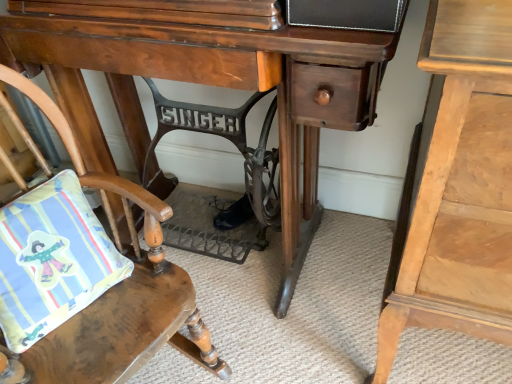
Where is `light wood nightstand at right`? This screenshot has width=512, height=384. light wood nightstand at right is located at coordinates (460, 185).

This screenshot has height=384, width=512. What do you see at coordinates (120, 290) in the screenshot? I see `wooden cushioned chair at lower left` at bounding box center [120, 290].

Find the location of a particular element. wooden desk at center is located at coordinates point(206,80).

This screenshot has height=384, width=512. Describe the element at coordinates (52, 260) in the screenshot. I see `matte cotton pillow at lower left` at that location.

The width and height of the screenshot is (512, 384). Identify the location of light wood nightstand at right. (460, 185).

Is wooden desk at center not inside wooden cushioned chair at lower left?

wooden desk at center lies outside wooden cushioned chair at lower left's area.

Consider the image. Which object is more forward, wooden desk at center or wooden cushioned chair at lower left?

Positioned in front is wooden cushioned chair at lower left.

Considering the sizes of objects wooden desk at center and wooden cushioned chair at lower left in the image provided, who is bigger, wooden desk at center or wooden cushioned chair at lower left?

With larger size is wooden desk at center.

Which object is wider, wooden desk at center or wooden cushioned chair at lower left?

wooden cushioned chair at lower left is wider.

Are wooden desk at center and light wood nightstand at right located far from each other?

No, there isn't a large distance between wooden desk at center and light wood nightstand at right.

Is wooden desk at center shorter than light wood nightstand at right?

Indeed, wooden desk at center has a lesser height compared to light wood nightstand at right.

Would you say wooden desk at center contains light wood nightstand at right?

No, light wood nightstand at right is not inside wooden desk at center.

From a real-world perspective, is wooden desk at center above or below light wood nightstand at right?

wooden desk at center is below light wood nightstand at right.

Relative to matte cotton pillow at lower left, is light wood nightstand at right in front or behind?

light wood nightstand at right is positioned closer to the viewer than matte cotton pillow at lower left.

Would you say light wood nightstand at right is to the left or to the right of matte cotton pillow at lower left in the picture?

light wood nightstand at right is positioned on matte cotton pillow at lower left's right side.

Is light wood nightstand at right facing towards matte cotton pillow at lower left?

No, light wood nightstand at right is not turned towards matte cotton pillow at lower left.

Measure the distance from light wood nightstand at right to matte cotton pillow at lower left.

light wood nightstand at right and matte cotton pillow at lower left are 23.46 inches apart.

Measure the distance from matte cotton pillow at lower left to light wood nightstand at right.

23.46 inches.

What are the coordinates of `nightstand lying above the matte cotton pillow at lower left (from the image's perspective)` in the screenshot? It's located at (460, 185).

From the image's perspective, who appears lower, matte cotton pillow at lower left or light wood nightstand at right?

matte cotton pillow at lower left, from the image's perspective.

Considering the relative sizes of wooden cushioned chair at lower left and wooden desk at center in the image provided, is wooden cushioned chair at lower left shorter than wooden desk at center?

Yes, wooden cushioned chair at lower left is shorter than wooden desk at center.

Can you tell me how much wooden cushioned chair at lower left and wooden desk at center differ in facing direction?

wooden cushioned chair at lower left and wooden desk at center are facing 68.8 degrees away from each other.

Considering the relative sizes of wooden cushioned chair at lower left and wooden desk at center in the image provided, is wooden cushioned chair at lower left bigger than wooden desk at center?

Actually, wooden cushioned chair at lower left might be smaller than wooden desk at center.

What are the coordinates of `desk that appears above the wooden cushioned chair at lower left (from the image's perspective)` in the screenshot? It's located at (206, 80).

Is point (65, 119) positioned before point (39, 252)?

No, (65, 119) is further to viewer.

Looking at this image, what's the angular difference between wooden cushioned chair at lower left and matte cotton pillow at lower left's facing directions?

There is a 0.974-degree angle between the facing directions of wooden cushioned chair at lower left and matte cotton pillow at lower left.

Is wooden cushioned chair at lower left touching matte cotton pillow at lower left?

wooden cushioned chair at lower left is not next to matte cotton pillow at lower left, and they're not touching.

Do you think wooden cushioned chair at lower left is within matte cotton pillow at lower left, or outside of it?

wooden cushioned chair at lower left cannot be found inside matte cotton pillow at lower left.

Is wooden desk at center aimed at matte cotton pillow at lower left?

Yes, wooden desk at center is turned towards matte cotton pillow at lower left.

How distant is wooden desk at center from matte cotton pillow at lower left?

They are 14.33 inches apart.

Is wooden desk at center placed right next to matte cotton pillow at lower left?

No, wooden desk at center is not next to matte cotton pillow at lower left.

Is wooden desk at center inside the boundaries of matte cotton pillow at lower left, or outside?

wooden desk at center exists outside the volume of matte cotton pillow at lower left.

Where is `chair lying in front of the wooden desk at center`? The image size is (512, 384). chair lying in front of the wooden desk at center is located at coordinates (120, 290).

Identify the location of desk above the light wood nightstand at right (from the image's perspective). (206, 80).

When comparing their distances from light wood nightstand at right, does matte cotton pillow at lower left or wooden desk at center seem further?

matte cotton pillow at lower left.

From the image, which object appears to be farther from wooden desk at center, wooden cushioned chair at lower left or light wood nightstand at right?

light wood nightstand at right lies further to wooden desk at center than the other object.

Considering their positions, is light wood nightstand at right positioned closer to wooden cushioned chair at lower left than wooden desk at center?

wooden desk at center is closer to wooden cushioned chair at lower left.

Estimate the real-world distances between objects in this image. Which object is closer to matte cotton pillow at lower left, wooden desk at center or light wood nightstand at right?

wooden desk at center is positioned closer to the anchor matte cotton pillow at lower left.

Considering their positions, is wooden desk at center positioned further to wooden cushioned chair at lower left than light wood nightstand at right?

Based on the image, light wood nightstand at right appears to be further to wooden cushioned chair at lower left.

Estimate the real-world distances between objects in this image. Which object is closer to wooden cushioned chair at lower left, wooden desk at center or matte cotton pillow at lower left?

The object closer to wooden cushioned chair at lower left is matte cotton pillow at lower left.

From the image, which object appears to be nearer to matte cotton pillow at lower left, light wood nightstand at right or wooden desk at center?

Among the two, wooden desk at center is located nearer to matte cotton pillow at lower left.

From the image, which object appears to be nearer to light wood nightstand at right, wooden cushioned chair at lower left or matte cotton pillow at lower left?

Based on the image, wooden cushioned chair at lower left appears to be nearer to light wood nightstand at right.

At what (x,y) coordinates should I click in order to perform the action: click on desk situated between matte cotton pillow at lower left and light wood nightstand at right from left to right. Please return your answer as a coordinate pair (x, y). Looking at the image, I should click on (206, 80).

Locate an element on the screen. The image size is (512, 384). pillow between wooden desk at center and wooden cushioned chair at lower left vertically is located at coordinates (52, 260).

This screenshot has height=384, width=512. In order to click on chair between matte cotton pillow at lower left and light wood nightstand at right in the horizontal direction in this screenshot , I will do `click(120, 290)`.

Where is `desk situated between wooden cushioned chair at lower left and light wood nightstand at right from left to right`? desk situated between wooden cushioned chair at lower left and light wood nightstand at right from left to right is located at coordinates (206, 80).